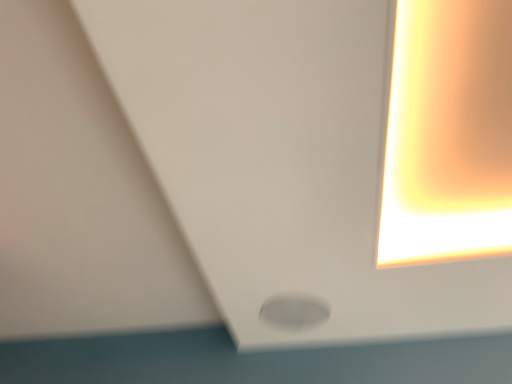
What do you see at coordinates (294, 312) in the screenshot? I see `white matte hole at lower center` at bounding box center [294, 312].

Measure the distance between white matte hole at lower center and camera.

white matte hole at lower center is 5.20 feet from camera.

Image resolution: width=512 pixels, height=384 pixels. In order to click on white matte hole at lower center in this screenshot , I will do `click(294, 312)`.

The image size is (512, 384). I want to click on white matte hole at lower center, so click(x=294, y=312).